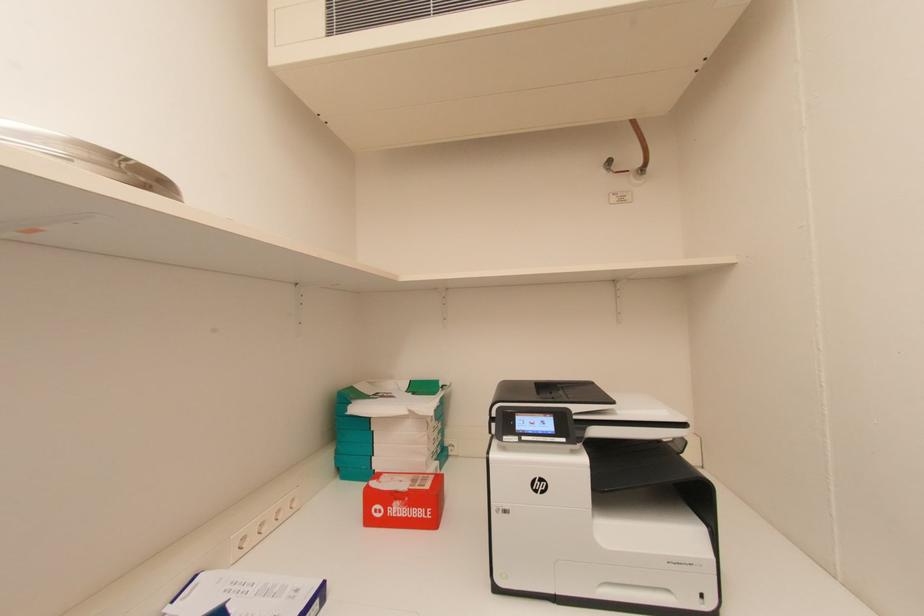
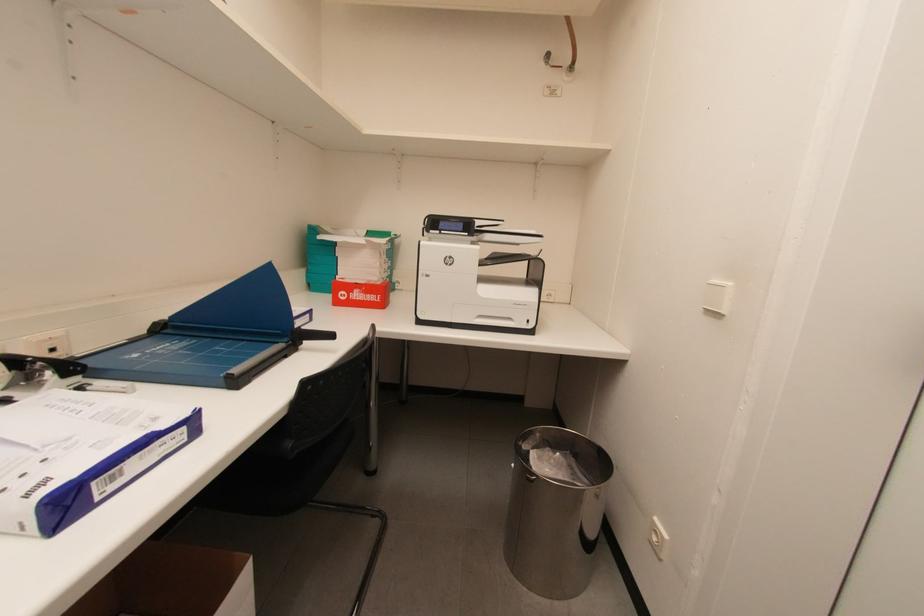
Question: Based on the continuous images, in which direction is the camera rotating? Reply with the corresponding letter.

Choices:
 (A) Left
 (B) Right
 (C) Up
 (D) Down

Answer: (D)